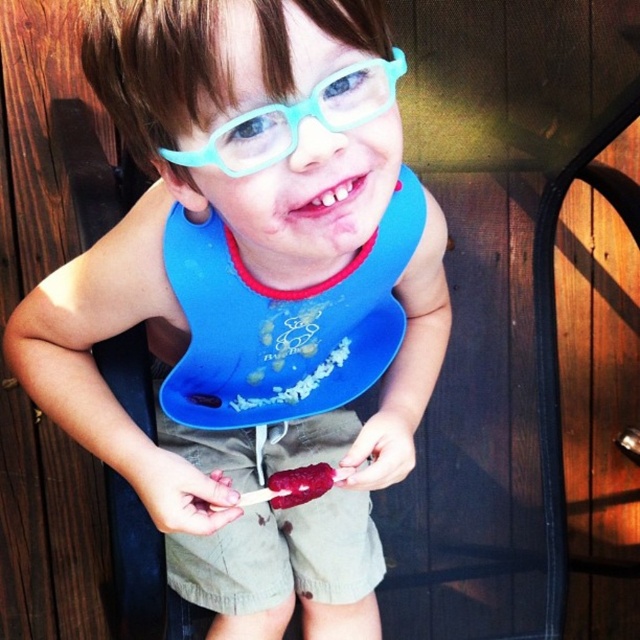
You are a parent trying to clean the blue rubber bib at center. You have a disinfectant spray that can reach up to 16 inches. Can you spray the bib from your current position without moving closer?

The blue rubber bib at center and viewer are 18.03 inches apart from each other, which is beyond the 16 inches reach of the disinfectant spray. Therefore, you need to move closer to spray the bib.

What is located at the coordinates point (252, 298) in the image?

The blue rubber bib at center is located at point (252, 298).

You are a photographer taking a picture of the child. To ensure both the tinted plastic glasses at upper center and the smooth raspberry ice cream at center are in focus, which object should you adjust your camera focus on first?

The smooth raspberry ice cream at center should be focused on first because the tinted plastic glasses at upper center is positioned on the right side of it, so adjusting focus starting from the center object ensures both are in focus.